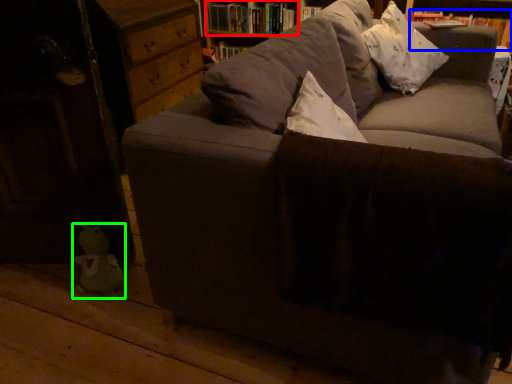
Question: Which object is positioned closest to book (highlighted by a red box)? Select from book (highlighted by a blue box) and toy (highlighted by a green box).

Choices:
 (A) book
 (B) toy

Answer: (A)